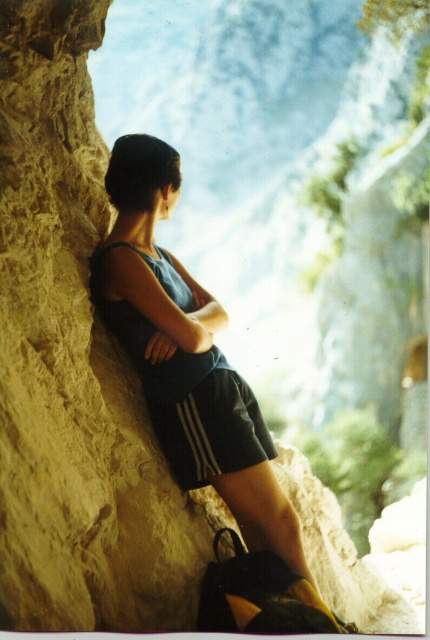
Question: Can you confirm if matte blue tank top at center is positioned below black cotton shorts at lower center?

Choices:
 (A) no
 (B) yes

Answer: (A)

Question: Is matte blue tank top at center behind black cotton shorts at lower center?

Choices:
 (A) yes
 (B) no

Answer: (B)

Question: Which of the following is the closest to the observer?

Choices:
 (A) (113, 244)
 (B) (208, 372)

Answer: (A)

Question: Among these objects, which one is farthest from the camera?

Choices:
 (A) matte blue tank top at center
 (B) black cotton shorts at lower center

Answer: (B)

Question: Does matte blue tank top at center have a larger size compared to black cotton shorts at lower center?

Choices:
 (A) yes
 (B) no

Answer: (A)

Question: Among these objects, which one is farthest from the camera?

Choices:
 (A) black cotton shorts at lower center
 (B) matte blue tank top at center

Answer: (A)